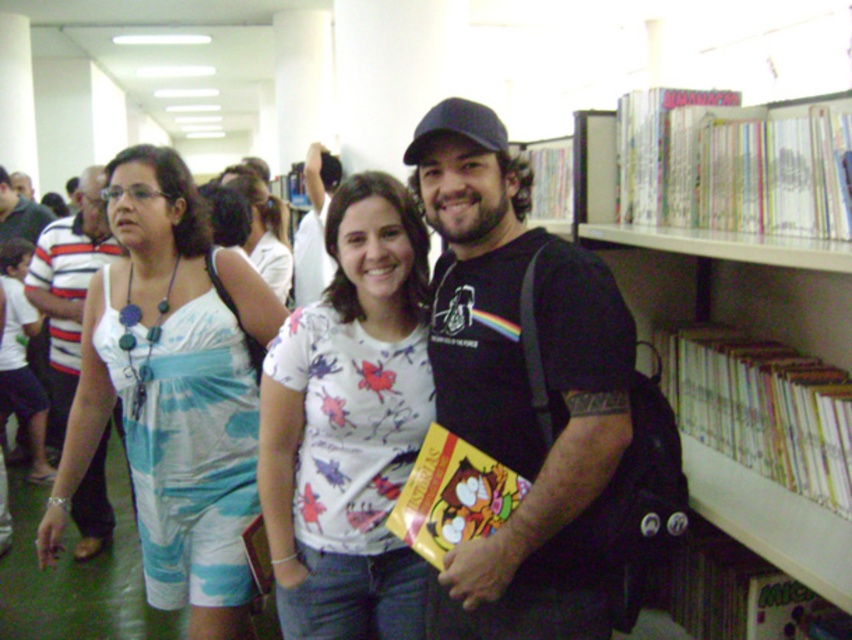
Question: Which of the following is the farthest from the observer?

Choices:
 (A) (556, 195)
 (B) (26, 401)

Answer: (B)

Question: Is black matte t-shirt at center behind matte black cap at upper center?

Choices:
 (A) no
 (B) yes

Answer: (A)

Question: Is striped cotton shirt at left to the left of white cotton shorts at left from the viewer's perspective?

Choices:
 (A) no
 (B) yes

Answer: (A)

Question: Which of the following is the closest to the observer?

Choices:
 (A) white fabric dress at left
 (B) matte black cap at upper center

Answer: (A)

Question: Considering the real-world distances, which object is closest to the white fabric shirt at upper center?

Choices:
 (A) yellow paper book at center
 (B) white printed shirt at center

Answer: (B)

Question: Observing the image, what is the correct spatial positioning of white printed shirt at center in reference to yellow paper book at center?

Choices:
 (A) below
 (B) above

Answer: (B)